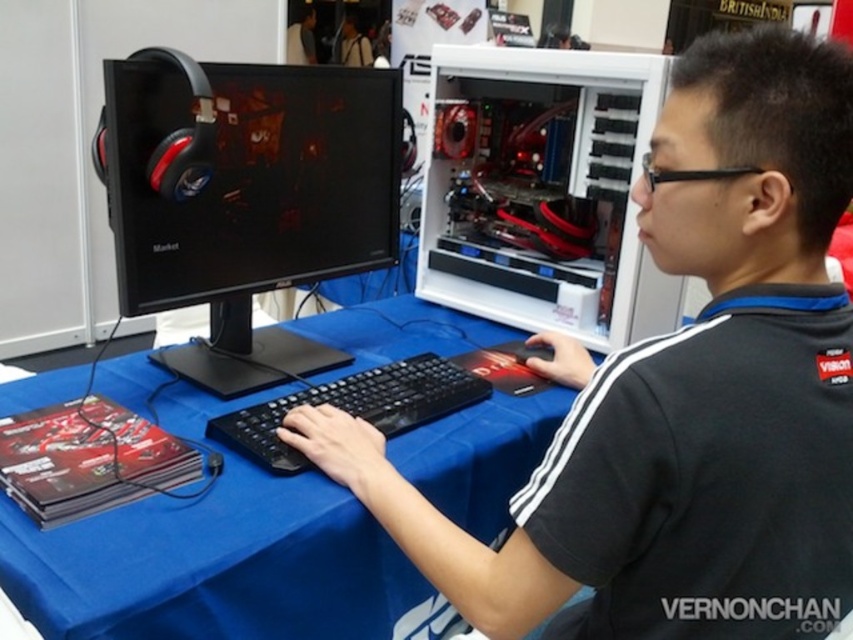
Can you confirm if blue fabric table at center is bigger than black matte keyboard at center?

Yes.

Between blue fabric table at center and black matte keyboard at center, which one has more height?

With more height is blue fabric table at center.

Which is behind, point (461, 438) or point (276, 451)?

Point (461, 438)

Identify the location of blue fabric table at center. The width and height of the screenshot is (853, 640). (219, 566).

Is black plastic monitor at left closer to the viewer compared to white plastic computer case at center?

Yes.

Consider the image. Is black plastic monitor at left thinner than white plastic computer case at center?

Correct, black plastic monitor at left's width is less than white plastic computer case at center's.

Image resolution: width=853 pixels, height=640 pixels. Describe the element at coordinates (244, 196) in the screenshot. I see `black plastic monitor at left` at that location.

I want to click on black plastic monitor at left, so click(244, 196).

The image size is (853, 640). What do you see at coordinates (219, 566) in the screenshot?
I see `blue fabric table at center` at bounding box center [219, 566].

What are the coordinates of `blue fabric table at center` in the screenshot? It's located at (219, 566).